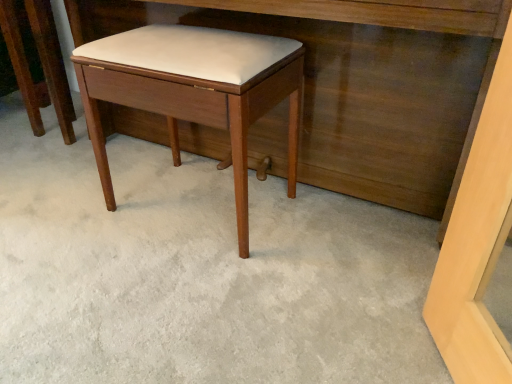
Find the location of `free space in front of matte wood stool at center`. free space in front of matte wood stool at center is located at coordinates (47, 157).